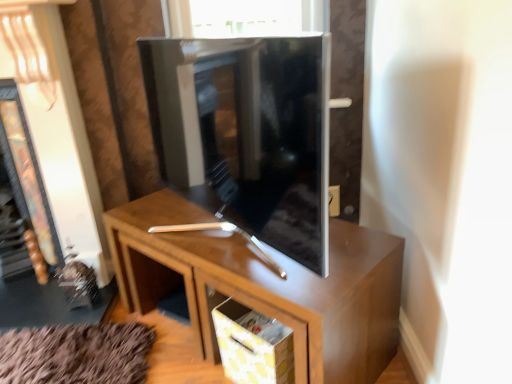
Question: Is glossy wood tv cabinet at center inside matte black fireplace at left?

Choices:
 (A) no
 (B) yes

Answer: (A)

Question: Can you confirm if matte black fireplace at left is thinner than glossy wood tv cabinet at center?

Choices:
 (A) no
 (B) yes

Answer: (A)

Question: Considering the relative positions of matte black fireplace at left and glossy wood tv cabinet at center in the image provided, is matte black fireplace at left to the right of glossy wood tv cabinet at center from the viewer's perspective?

Choices:
 (A) yes
 (B) no

Answer: (B)

Question: Could you tell me if matte black fireplace at left is facing glossy wood tv cabinet at center?

Choices:
 (A) no
 (B) yes

Answer: (A)

Question: Is matte black fireplace at left next to glossy wood tv cabinet at center and touching it?

Choices:
 (A) no
 (B) yes

Answer: (A)

Question: Does matte black fireplace at left come in front of glossy wood tv cabinet at center?

Choices:
 (A) yes
 (B) no

Answer: (B)

Question: Can you confirm if glossy wood tv cabinet at center is taller than brown wood cabinet at center?

Choices:
 (A) yes
 (B) no

Answer: (A)

Question: Is glossy wood tv cabinet at center turned away from brown wood cabinet at center?

Choices:
 (A) no
 (B) yes

Answer: (A)

Question: From a real-world perspective, is glossy wood tv cabinet at center positioned under brown wood cabinet at center based on gravity?

Choices:
 (A) no
 (B) yes

Answer: (A)

Question: Is glossy wood tv cabinet at center bigger than brown wood cabinet at center?

Choices:
 (A) yes
 (B) no

Answer: (B)

Question: From the image's perspective, does glossy wood tv cabinet at center appear higher than brown wood cabinet at center?

Choices:
 (A) yes
 (B) no

Answer: (A)

Question: Does glossy wood tv cabinet at center have a greater width compared to brown wood cabinet at center?

Choices:
 (A) yes
 (B) no

Answer: (B)

Question: Is yellow dotted fabric drawer at lower center in contact with brown wood cabinet at center?

Choices:
 (A) yes
 (B) no

Answer: (B)